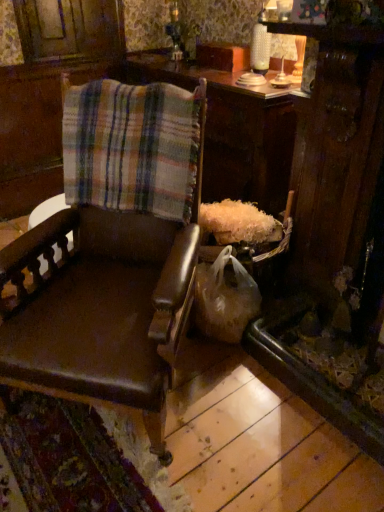
Question: From the image's perspective, is wooden table at center located above or below brown leather chair at left?

Choices:
 (A) below
 (B) above

Answer: (B)

Question: Considering their positions, is wooden table at center located in front of or behind brown leather chair at left?

Choices:
 (A) behind
 (B) front

Answer: (A)

Question: Considering the real-world distances, which object is farthest from the brown leather chair at left?

Choices:
 (A) plaid fabric at center
 (B) wooden table at center

Answer: (B)

Question: Based on their relative distances, which object is nearer to the plaid fabric at center?

Choices:
 (A) brown leather chair at left
 (B) wooden table at center

Answer: (A)